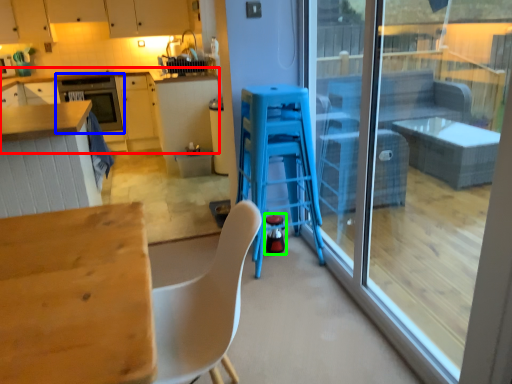
Question: Which object is positioned closest to cabinetry (highlighted by a red box)? Select from oven (highlighted by a blue box) and appliance (highlighted by a green box).

Choices:
 (A) oven
 (B) appliance

Answer: (A)